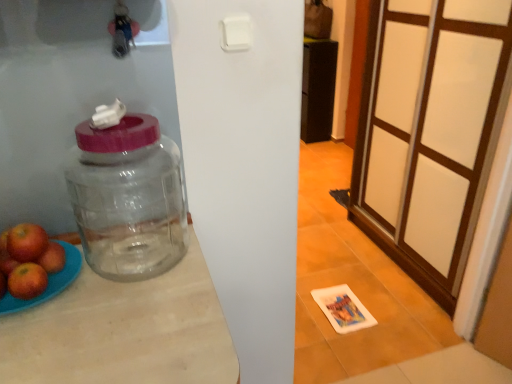
What is the approximate height of clear wood table at center?

It is 25.58 inches.

Find the location of a particular element. The width and height of the screenshot is (512, 384). transparent glass jar at left is located at coordinates (128, 198).

What do you see at coordinates (27, 281) in the screenshot?
I see `red matte apple at left, which appears as the third apple when viewed from the left` at bounding box center [27, 281].

Locate an element on the screen. The width and height of the screenshot is (512, 384). clear wood table at center is located at coordinates (124, 331).

Can you confirm if red matte apple at left, placed as the first apple when sorted from right to left, is thinner than white frosted glass screen door at right?

Yes.

Which is more to the left, red matte apple at left, placed as the first apple when sorted from right to left, or white frosted glass screen door at right?

red matte apple at left, placed as the first apple when sorted from right to left, is more to the left.

Is red matte apple at left, which appears as the third apple when viewed from the left, bigger or smaller than white frosted glass screen door at right?

red matte apple at left, which appears as the third apple when viewed from the left, is smaller than white frosted glass screen door at right.

Is red matte apple at left, placed as the first apple when sorted from right to left, taller or shorter than white frosted glass screen door at right?

red matte apple at left, placed as the first apple when sorted from right to left, is shorter than white frosted glass screen door at right.

Can you confirm if white frosted glass screen door at right is smaller than red matte apple at left, which appears as the second apple when viewed from the left?

Incorrect, white frosted glass screen door at right is not smaller in size than red matte apple at left, which appears as the second apple when viewed from the left.

From the image's perspective, is white frosted glass screen door at right positioned above or below red matte apple at left, which is counted as the second apple, starting from the right?

Clearly, from the image's perspective, white frosted glass screen door at right is above red matte apple at left, which is counted as the second apple, starting from the right.

Is white frosted glass screen door at right directly adjacent to red matte apple at left, which is counted as the second apple, starting from the right?

No, white frosted glass screen door at right is not next to red matte apple at left, which is counted as the second apple, starting from the right.

Which of these two, white frosted glass screen door at right or red matte apple at left, which appears as the second apple when viewed from the left, stands taller?

white frosted glass screen door at right is taller.

Which of these two, red matte apple at left, which is the 1th apple in left-to-right order, or red matte apple at left, placed as the first apple when sorted from right to left, stands shorter?

red matte apple at left, which is the 1th apple in left-to-right order.

Is red matte apple at left, which appears as the third apple when viewed from the left, inside red matte apple at left, which is the 1th apple in left-to-right order?

No, red matte apple at left, which appears as the third apple when viewed from the left, is not inside red matte apple at left, which is the 1th apple in left-to-right order.

Is red matte apple at left, marked as the third apple in a right-to-left arrangement, wider or thinner than red matte apple at left, which appears as the third apple when viewed from the left?

red matte apple at left, marked as the third apple in a right-to-left arrangement, is wider than red matte apple at left, which appears as the third apple when viewed from the left.

Which object is thinner, red matte apple at left, placed as the first apple when sorted from right to left, or red matte apple at left, marked as the third apple in a right-to-left arrangement?

red matte apple at left, placed as the first apple when sorted from right to left, is thinner.

Does point (31, 290) come in front of point (42, 244)?

Yes.

From a real-world perspective, is red matte apple at left, placed as the first apple when sorted from right to left, below red matte apple at left, marked as the third apple in a right-to-left arrangement?

No.

Can you see red matte apple at left, which appears as the third apple when viewed from the left, touching red matte apple at left, marked as the third apple in a right-to-left arrangement?

Indeed, red matte apple at left, which appears as the third apple when viewed from the left, and red matte apple at left, marked as the third apple in a right-to-left arrangement, are beside each other and touching.

Based on the photo, is transparent glass jar at left to the left of clear wood table at center from the viewer's perspective?

Yes, transparent glass jar at left is to the left of clear wood table at center.

Is the surface of transparent glass jar at left in direct contact with clear wood table at center?

transparent glass jar at left and clear wood table at center are not in contact.

Is transparent glass jar at left in front of clear wood table at center?

No, it is not.

From a real-world perspective, relative to clear wood table at center, is transparent glass jar at left vertically above or below?

In terms of real-world spatial position, transparent glass jar at left is above clear wood table at center.

Between point (33, 233) and point (36, 264), which one is positioned in front?

The point (36, 264) is closer to the camera.

How different are the orientations of red matte apple at left, which is counted as the second apple, starting from the right, and red matte apple at left, placed as the first apple when sorted from right to left, in degrees?

The facing directions of red matte apple at left, which is counted as the second apple, starting from the right, and red matte apple at left, placed as the first apple when sorted from right to left, are 0.00157 degrees apart.

Does red matte apple at left, which appears as the second apple when viewed from the left, contain red matte apple at left, placed as the first apple when sorted from right to left?

Definitely not — red matte apple at left, placed as the first apple when sorted from right to left, is not inside red matte apple at left, which appears as the second apple when viewed from the left.

Who is taller, white frosted glass screen door at right or red matte apple at left, which appears as the third apple when viewed from the left?

With more height is white frosted glass screen door at right.

Is white frosted glass screen door at right beside red matte apple at left, which appears as the third apple when viewed from the left?

No, white frosted glass screen door at right is not next to red matte apple at left, which appears as the third apple when viewed from the left.

Is white frosted glass screen door at right to the left of red matte apple at left, placed as the first apple when sorted from right to left, from the viewer's perspective?

No.

In terms of size, does white frosted glass screen door at right appear bigger or smaller than red matte apple at left, placed as the first apple when sorted from right to left?

Clearly, white frosted glass screen door at right is larger in size than red matte apple at left, placed as the first apple when sorted from right to left.

Identify the location of screen door directly beneath the red matte apple at left, which appears as the third apple when viewed from the left (from a real-world perspective). (424, 140).

Which apple is the 1st one when counting from the front of the white frosted glass screen door at right? Please provide its 2D coordinates.

[(26, 242)]

From the image, which object appears to be farther from red matte apple at left, which appears as the second apple when viewed from the left, clear wood table at center or red matte apple at left, which appears as the third apple when viewed from the left?

clear wood table at center.

From the image, which object appears to be nearer to red matte apple at left, which is counted as the second apple, starting from the right, clear wood table at center or red matte apple at left, marked as the third apple in a right-to-left arrangement?

Among the two, red matte apple at left, marked as the third apple in a right-to-left arrangement, is located nearer to red matte apple at left, which is counted as the second apple, starting from the right.

Which object lies nearer to the anchor point white frosted glass screen door at right, red matte apple at left, marked as the third apple in a right-to-left arrangement, or red matte apple at left, which appears as the third apple when viewed from the left?

red matte apple at left, marked as the third apple in a right-to-left arrangement.

Which object lies further to the anchor point white frosted glass screen door at right, red matte apple at left, which appears as the second apple when viewed from the left, or red matte apple at left, which is the 1th apple in left-to-right order?

red matte apple at left, which appears as the second apple when viewed from the left.

Estimate the real-world distances between objects in this image. Which object is further from red matte apple at left, which is the 1th apple in left-to-right order, clear wood table at center or red matte apple at left, which appears as the second apple when viewed from the left?

clear wood table at center lies further to red matte apple at left, which is the 1th apple in left-to-right order, than the other object.

Looking at the image, which one is located further to red matte apple at left, which appears as the second apple when viewed from the left, white frosted glass screen door at right or clear wood table at center?

white frosted glass screen door at right is further to red matte apple at left, which appears as the second apple when viewed from the left.

Estimate the real-world distances between objects in this image. Which object is closer to red matte apple at left, which appears as the third apple when viewed from the left, red matte apple at left, which appears as the second apple when viewed from the left, or clear wood table at center?

Based on the image, red matte apple at left, which appears as the second apple when viewed from the left, appears to be nearer to red matte apple at left, which appears as the third apple when viewed from the left.

When comparing their distances from transparent glass jar at left, does clear wood table at center or red matte apple at left, placed as the first apple when sorted from right to left, seem further?

Among the two, red matte apple at left, placed as the first apple when sorted from right to left, is located further to transparent glass jar at left.

I want to click on table between transparent glass jar at left and white frosted glass screen door at right, so click(x=124, y=331).

Locate an element on the screen. The height and width of the screenshot is (384, 512). bottle situated between red matte apple at left, which is the 1th apple in left-to-right order, and white frosted glass screen door at right from left to right is located at coordinates (128, 198).

Identify the location of bottle situated between red matte apple at left, placed as the first apple when sorted from right to left, and white frosted glass screen door at right from left to right. (128, 198).

You are a GUI agent. You are given a task and a screenshot of the screen. Output one action in this format:
    pyautogui.click(x=<x>, y=<y>)
    Task: Click on the apple situated between red matte apple at left, which appears as the second apple when viewed from the left, and transparent glass jar at left from left to right
    This screenshot has height=384, width=512.
    Given the screenshot: What is the action you would take?
    pyautogui.click(x=27, y=281)